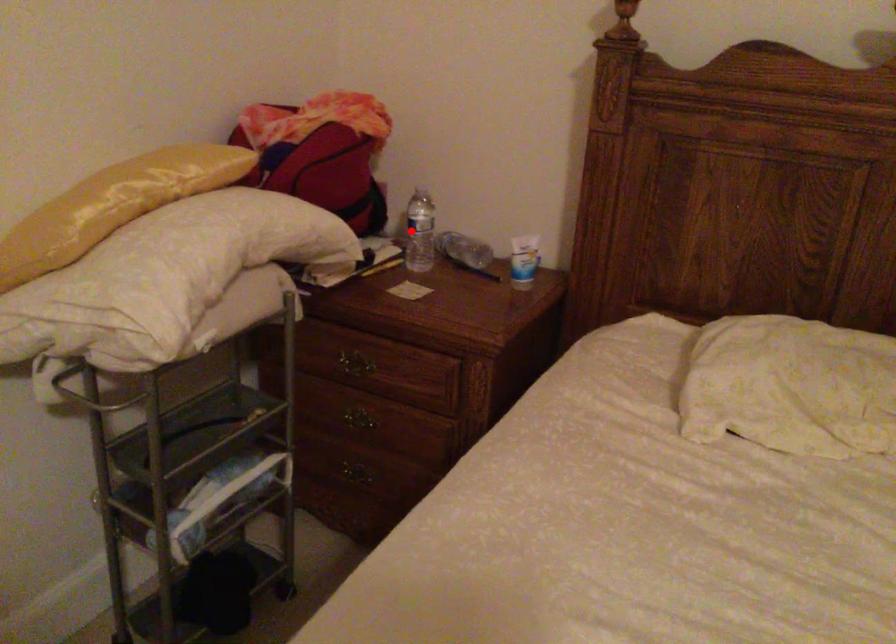
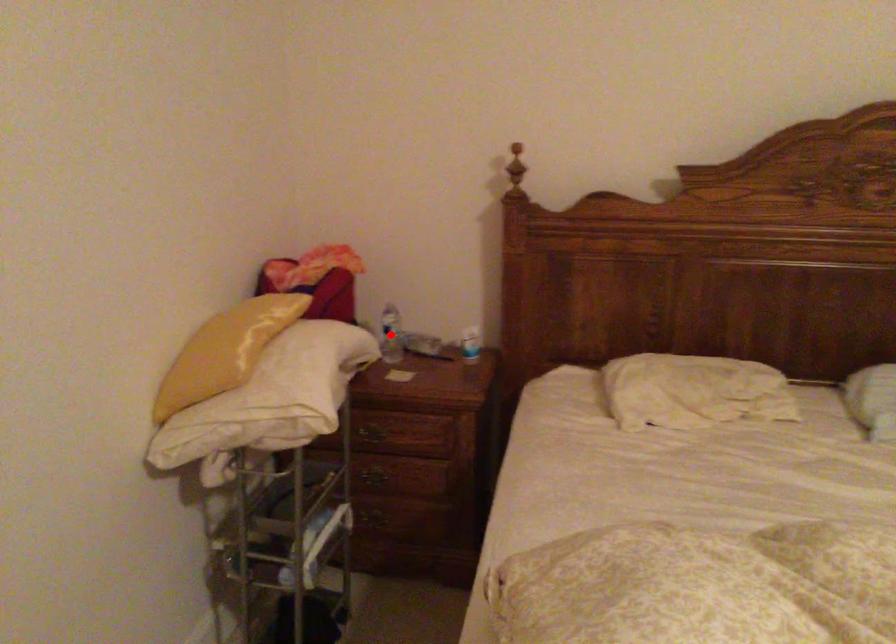
I am providing you with two images of the same scene from different viewpoints. A red point is marked on the first image and another point is marked on the second image. Does the point marked in image1 correspond to the same location as the one in image2?

Yes